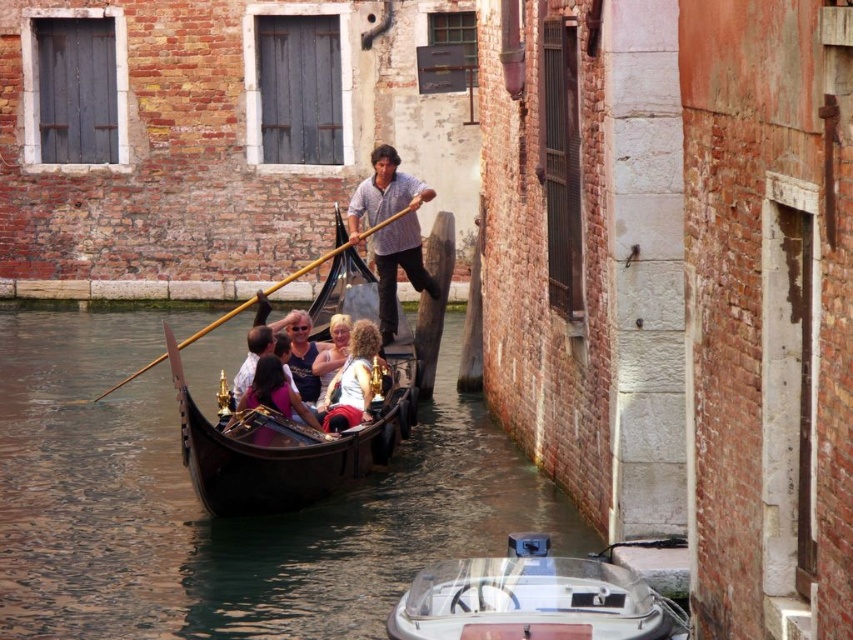
Question: Is matte striped shirt at center smaller than white cotton shirt at center?

Choices:
 (A) yes
 (B) no

Answer: (B)

Question: Which of the following is the farthest from the observer?

Choices:
 (A) (335, 403)
 (B) (273, 385)
 (C) (318, 355)
 (D) (296, 342)

Answer: (C)

Question: Which object is the closest to the matte blue tank top at center?

Choices:
 (A) matte black shirt at center
 (B) black water at center

Answer: (A)

Question: Does white glossy motorboat at center have a smaller size compared to matte blue tank top at center?

Choices:
 (A) no
 (B) yes

Answer: (B)

Question: Can you confirm if white glossy motorboat at center is smaller than matte striped shirt at center?

Choices:
 (A) no
 (B) yes

Answer: (B)

Question: Estimate the real-world distances between objects in this image. Which object is farther from the matte blue tank top at center?

Choices:
 (A) matte striped shirt at center
 (B) white cotton shirt at center

Answer: (A)